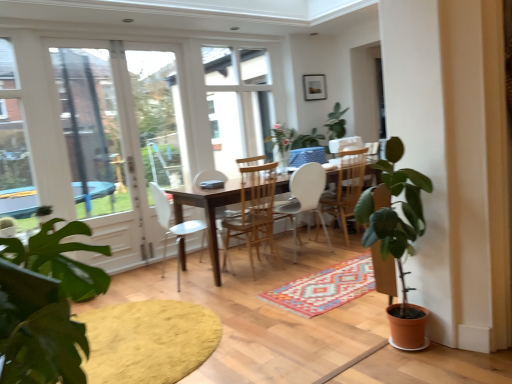
Image resolution: width=512 pixels, height=384 pixels. I want to click on vacant space situated above yellow felt mat at lower center (from a real-world perspective), so click(x=137, y=336).